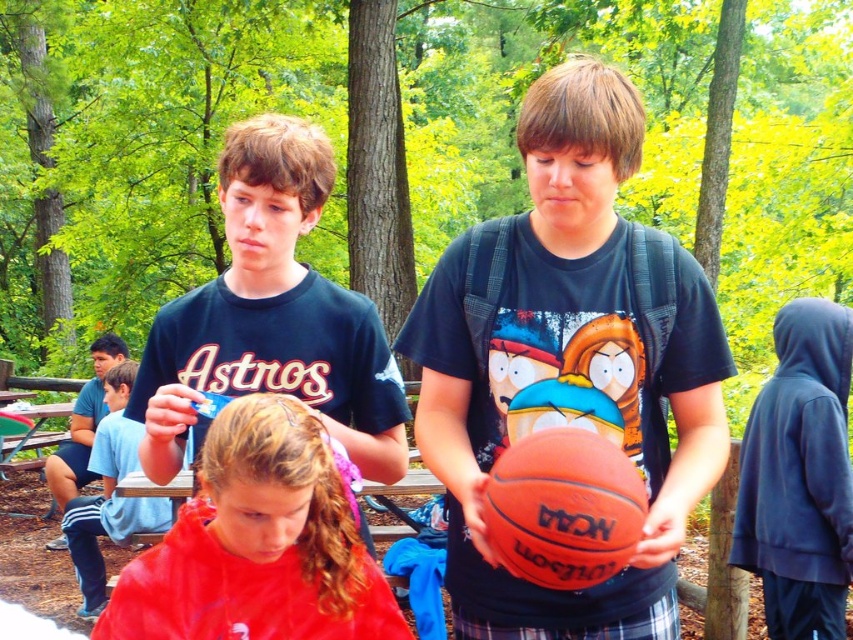
You are a photographer trying to capture both the shiny red cape at center and the orange matte basketball at center in the same frame. Based on their sizes, which object should you focus on first to ensure both fit in the frame?

The shiny red cape at center might be wider than orange matte basketball at center, so you should focus on the shiny red cape at center first to ensure both fit in the frame.